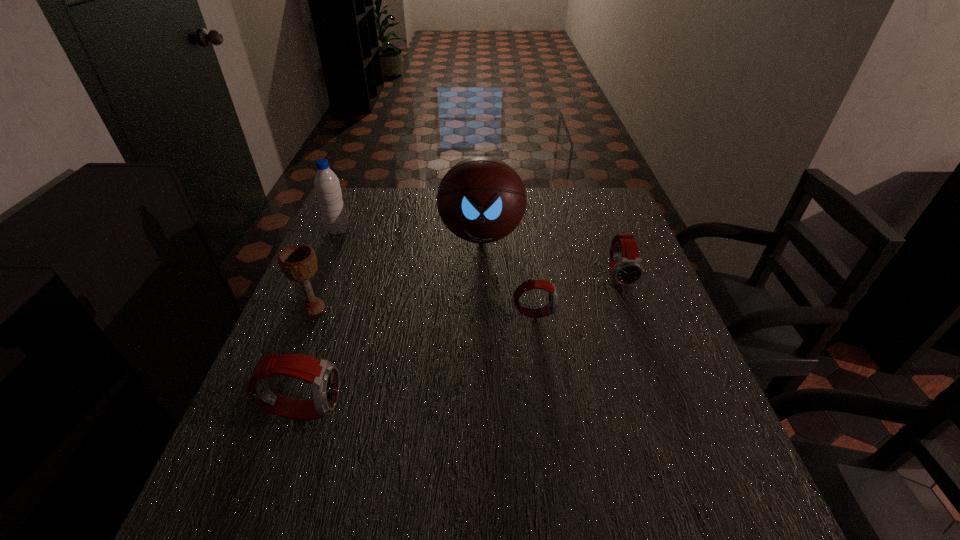
You are a GUI agent. You are given a task and a screenshot of the screen. Output one action in this format:
    pyautogui.click(x=<x>, y=<y>)
    Task: Click on the nearest watch
    This screenshot has width=960, height=540.
    Given the screenshot: What is the action you would take?
    323,377

Find the location of a particular element. The height and width of the screenshot is (540, 960). the nearest object is located at coordinates (323, 377).

The width and height of the screenshot is (960, 540). Identify the location of the second farthest watch. (552, 305).

I want to click on the shortest object, so click(552, 305).

The width and height of the screenshot is (960, 540). Identify the location of the rightmost object. click(626, 268).

Locate an element on the screen. The image size is (960, 540). the second shortest object is located at coordinates (626, 268).

At what (x,y) coordinates should I click in order to perform the action: click on water bottle. Please return your answer as a coordinate pair (x, y). Looking at the image, I should click on (327, 186).

I want to click on chalice, so click(298, 262).

Where is `basketball`? The width and height of the screenshot is (960, 540). basketball is located at coordinates (481, 199).

Find the location of a particular element. The width and height of the screenshot is (960, 540). vacant space situated 0.190m on the face of the nearest watch is located at coordinates (439, 409).